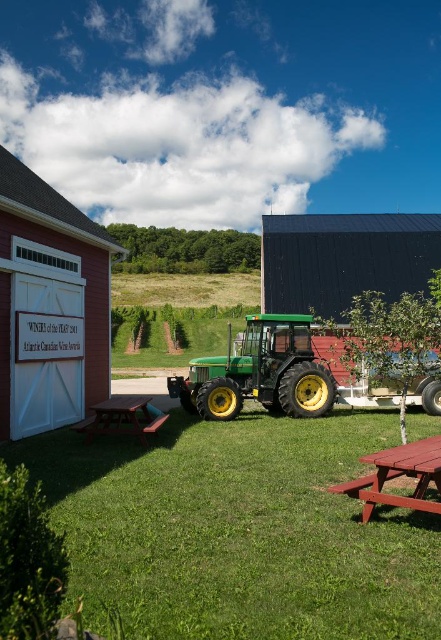
You are standing at the tractor and looking towards the red barn. There are two points marked in the scene. Which point is closer to you, point at [277,508] or point at [430,460]?

Point at [277,508] is closer to you than point at [430,460] because it is further to the viewer.

You are planning to host a small outdoor event and need to move the red wood picnic table at lower right to make space. Based on the scene, can you determine if the green matte tractor at center is blocking the path to the picnic table?

The green matte tractor at center is positioned over red wood picnic table at lower right, meaning the tractor is directly above the picnic table. This would block access to the picnic table, so you would need to move the tractor first before relocating the picnic table.

Based on the photo, you are planning to set up a small garden in the area shown. You have a garden bed that is the same size as the red wood picnic table at lower right. Can the garden bed fit in the space currently occupied by the green grass at center?

The green grass at center is smaller than the red wood picnic table at lower right. Since the garden bed is the same size as the picnic table, it cannot fit in the space occupied by the grass because the grass area is smaller.